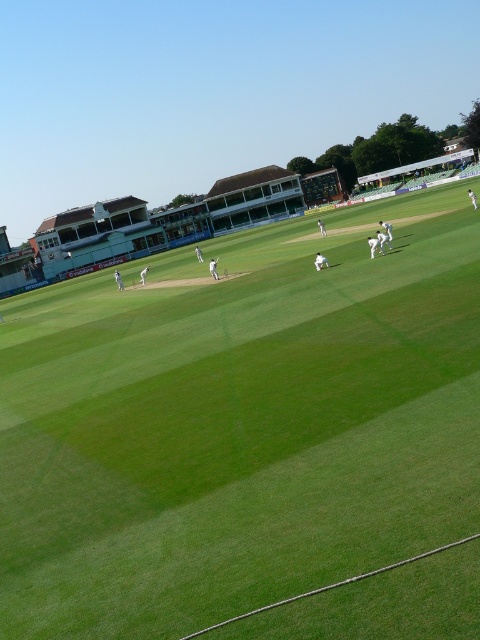
Question: Which object is closer to the camera taking this photo?

Choices:
 (A) white cloth cricket bat at center
 (B) green grass cricket field at center

Answer: (B)

Question: Which point appears closest to the camera in this image?

Choices:
 (A) (332, 337)
 (B) (319, 262)

Answer: (A)

Question: Does green grass cricket field at center have a smaller size compared to white cloth cricket bat at center?

Choices:
 (A) no
 (B) yes

Answer: (A)

Question: Is green grass cricket field at center below white cloth cricket bat at center?

Choices:
 (A) yes
 (B) no

Answer: (A)

Question: Is green grass cricket field at center to the left of white cloth cricket bat at center from the viewer's perspective?

Choices:
 (A) no
 (B) yes

Answer: (B)